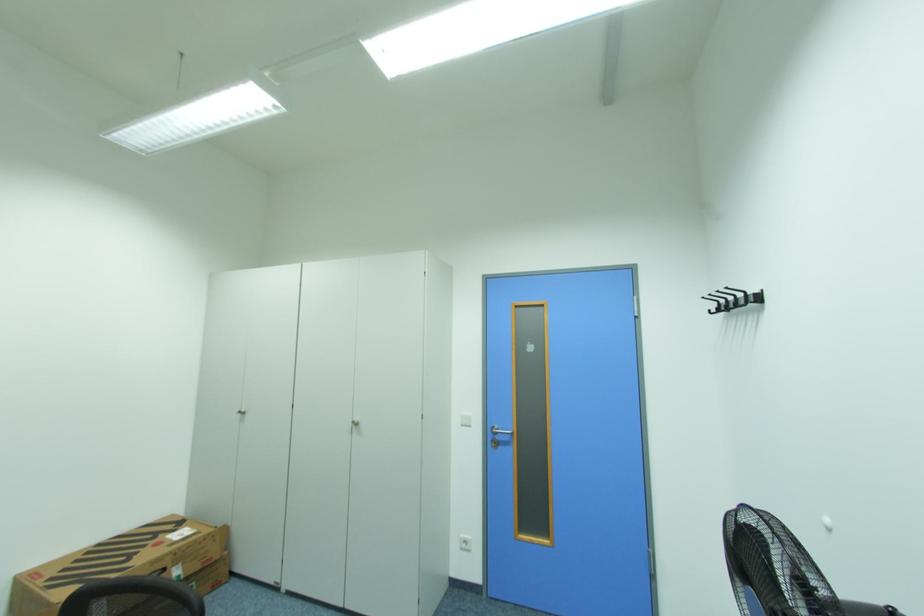
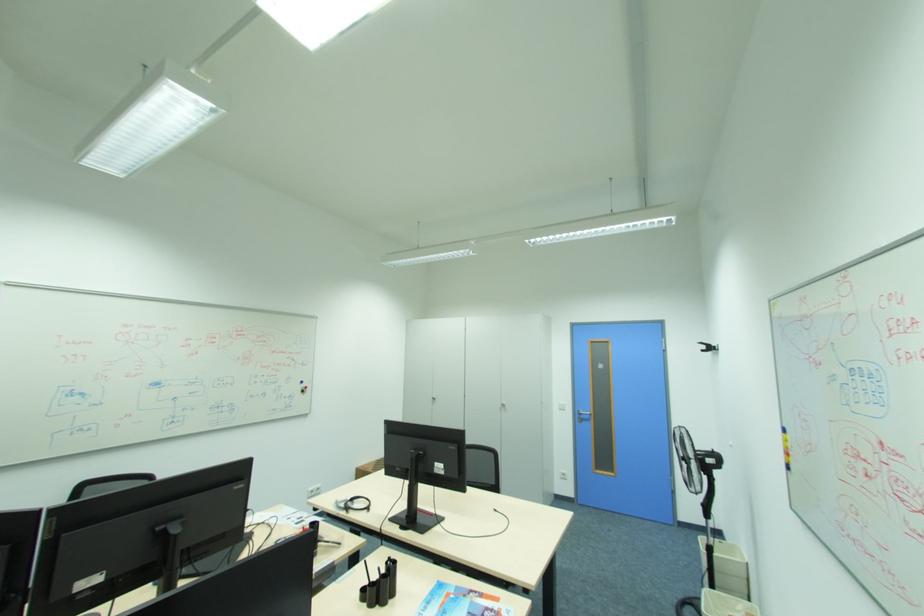
Question: The images are taken continuously from a first-person perspective. In which direction are you moving?

Choices:
 (A) Left
 (B) Right
 (C) Forward
 (D) Backward

Answer: (D)